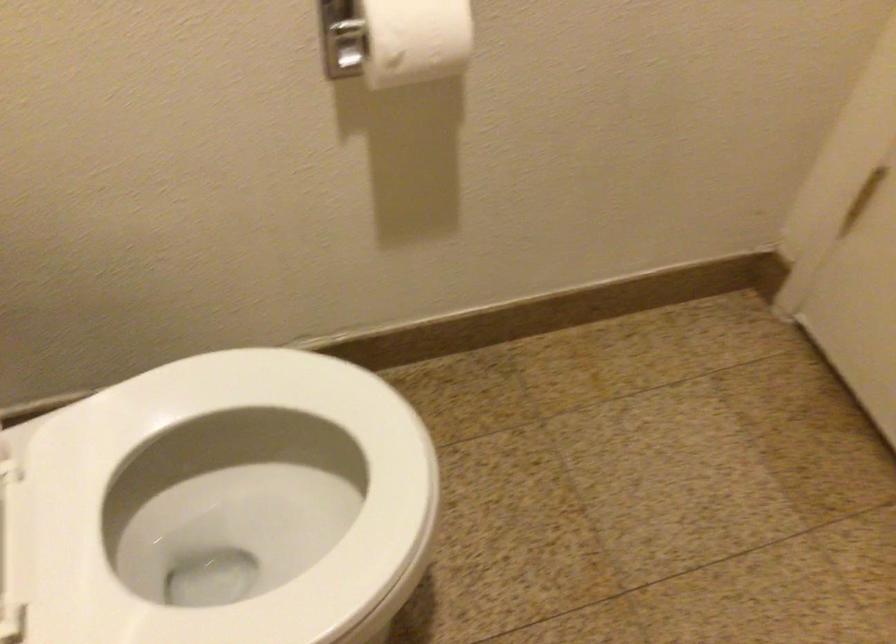
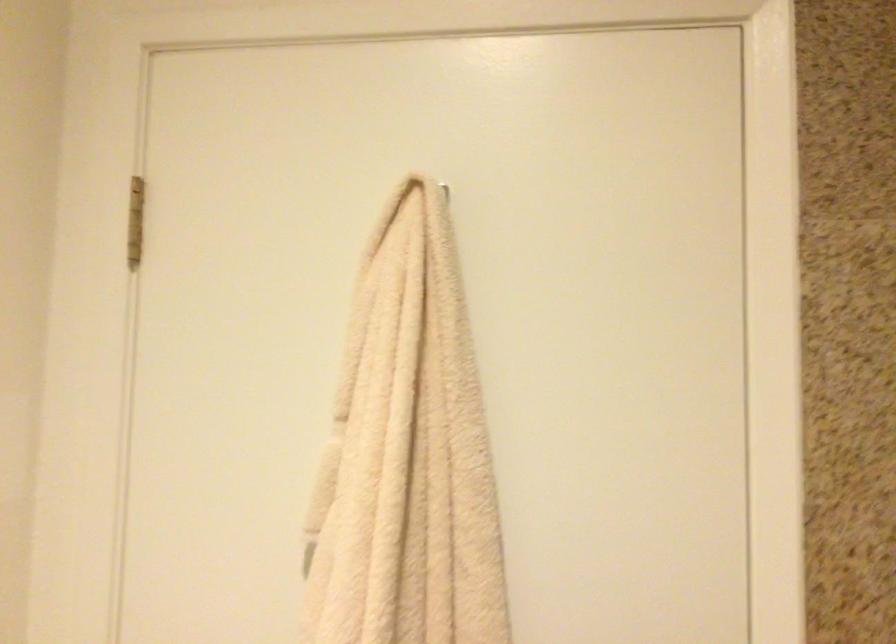
The images are taken continuously from a first-person perspective. In which direction is your viewpoint rotating?

The camera rotated toward right-up.